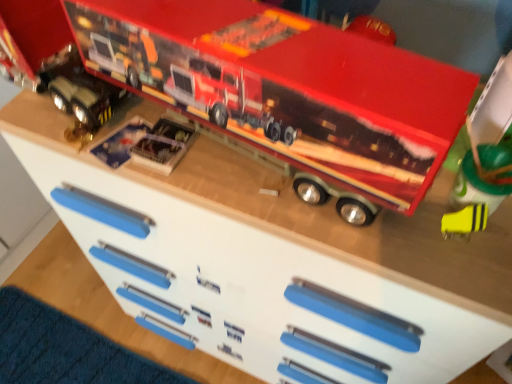
This screenshot has width=512, height=384. What do you see at coordinates (163, 145) in the screenshot?
I see `clear plastic toy at center, marked as the second toy in a left-to-right arrangement` at bounding box center [163, 145].

Describe the element at coordinates (287, 88) in the screenshot. I see `metallic red truck at upper center, placed as the 3th toy when sorted from left to right` at that location.

Identify the location of metallic silver toy truck at center, positioned as the fourth toy in right-to-left order. 121,142.

Describe the element at coordinates (464, 221) in the screenshot. Image resolution: width=512 pixels, height=384 pixels. I see `yellow matte eraser at lower right, which is the fourth toy from left to right` at that location.

Based on the photo, measure the distance between point (472, 229) and camera.

The depth of point (472, 229) is 20.71 inches.

Find the location of a particular element. clear plastic toy at center, which is counted as the third toy, starting from the right is located at coordinates (163, 145).

Would you say clear plastic toy at center, which is counted as the third toy, starting from the right, is to the left or to the right of yellow matte eraser at lower right, which is the fourth toy from left to right, in the picture?

clear plastic toy at center, which is counted as the third toy, starting from the right, is to the left of yellow matte eraser at lower right, which is the fourth toy from left to right.

Which point is more forward, (165,131) or (467,233)?

Point (467,233)

Is clear plastic toy at center, marked as the second toy in a left-to-right arrangement, not close to yellow matte eraser at lower right, placed as the first toy when sorted from right to left?

No.

Is clear plastic toy at center, which is counted as the third toy, starting from the right, oriented away from yellow matte eraser at lower right, which is the fourth toy from left to right?

No.

From the image's perspective, is clear plastic toy at center, which is counted as the third toy, starting from the right, below metallic red truck at upper center, placed as the 3th toy when sorted from left to right?

Yes, from the image's perspective, clear plastic toy at center, which is counted as the third toy, starting from the right, is beneath metallic red truck at upper center, placed as the 3th toy when sorted from left to right.

Is clear plastic toy at center, marked as the second toy in a left-to-right arrangement, with metallic red truck at upper center, placed as the 3th toy when sorted from left to right?

No, clear plastic toy at center, marked as the second toy in a left-to-right arrangement, is not with metallic red truck at upper center, placed as the 3th toy when sorted from left to right.

Is clear plastic toy at center, which is counted as the third toy, starting from the right, to the left or to the right of metallic red truck at upper center, placed as the 3th toy when sorted from left to right, in the image?

Clearly, clear plastic toy at center, which is counted as the third toy, starting from the right, is on the left of metallic red truck at upper center, placed as the 3th toy when sorted from left to right, in the image.

Is metallic red truck at upper center, placed as the 3th toy when sorted from left to right, at the back of clear plastic toy at center, which is counted as the third toy, starting from the right?

Yes, metallic red truck at upper center, placed as the 3th toy when sorted from left to right, is at the back of clear plastic toy at center, which is counted as the third toy, starting from the right.

From a real-world perspective, is yellow matte eraser at lower right, placed as the first toy when sorted from right to left, physically below metallic red truck at upper center, which ranks as the 2th toy in right-to-left order?

Yes.

Is yellow matte eraser at lower right, which is the fourth toy from left to right, facing towards metallic red truck at upper center, which ranks as the 2th toy in right-to-left order?

No, yellow matte eraser at lower right, which is the fourth toy from left to right, is not turned towards metallic red truck at upper center, which ranks as the 2th toy in right-to-left order.

Which object is further away from the camera, yellow matte eraser at lower right, placed as the first toy when sorted from right to left, or clear plastic toy at center, marked as the second toy in a left-to-right arrangement?

clear plastic toy at center, marked as the second toy in a left-to-right arrangement, is further from the camera.

From a real-world perspective, is yellow matte eraser at lower right, which is the fourth toy from left to right, beneath clear plastic toy at center, marked as the second toy in a left-to-right arrangement?

Incorrect, from a real-world perspective, yellow matte eraser at lower right, which is the fourth toy from left to right, is higher than clear plastic toy at center, marked as the second toy in a left-to-right arrangement.

How distant is yellow matte eraser at lower right, placed as the first toy when sorted from right to left, from clear plastic toy at center, marked as the second toy in a left-to-right arrangement?

yellow matte eraser at lower right, placed as the first toy when sorted from right to left, and clear plastic toy at center, marked as the second toy in a left-to-right arrangement, are 15.25 inches apart from each other.

Which object is positioned more to the right, yellow matte eraser at lower right, which is the fourth toy from left to right, or clear plastic toy at center, which is counted as the third toy, starting from the right?

Positioned to the right is yellow matte eraser at lower right, which is the fourth toy from left to right.

Does metallic red truck at upper center, which ranks as the 2th toy in right-to-left order, appear on the left side of metallic silver toy truck at center, arranged as the 1th toy when viewed from the left?

No, metallic red truck at upper center, which ranks as the 2th toy in right-to-left order, is not to the left of metallic silver toy truck at center, arranged as the 1th toy when viewed from the left.

How different are the orientations of metallic red truck at upper center, placed as the 3th toy when sorted from left to right, and metallic silver toy truck at center, arranged as the 1th toy when viewed from the left, in degrees?

The angle between the facing direction of metallic red truck at upper center, placed as the 3th toy when sorted from left to right, and the facing direction of metallic silver toy truck at center, arranged as the 1th toy when viewed from the left, is 5.5 degrees.

From a real-world perspective, which object rests below the other?

metallic silver toy truck at center, positioned as the fourth toy in right-to-left order.

Is metallic red truck at upper center, which ranks as the 2th toy in right-to-left order, aimed at metallic silver toy truck at center, positioned as the fourth toy in right-to-left order?

A: No, metallic red truck at upper center, which ranks as the 2th toy in right-to-left order, is not oriented towards metallic silver toy truck at center, positioned as the fourth toy in right-to-left order.

Does point (116, 155) come behind point (429, 137)?

Yes.

Could metallic red truck at upper center, placed as the 3th toy when sorted from left to right, be considered to be inside metallic silver toy truck at center, positioned as the fourth toy in right-to-left order?

No, metallic red truck at upper center, placed as the 3th toy when sorted from left to right, is not a part of metallic silver toy truck at center, positioned as the fourth toy in right-to-left order.

Which object is closer to the camera, metallic silver toy truck at center, arranged as the 1th toy when viewed from the left, or metallic red truck at upper center, which ranks as the 2th toy in right-to-left order?

Positioned in front is metallic red truck at upper center, which ranks as the 2th toy in right-to-left order.

From the image's perspective, which is below, metallic silver toy truck at center, positioned as the fourth toy in right-to-left order, or metallic red truck at upper center, placed as the 3th toy when sorted from left to right?

From the image's view, metallic silver toy truck at center, positioned as the fourth toy in right-to-left order, is below.

Which is correct: metallic red truck at upper center, which ranks as the 2th toy in right-to-left order, is inside yellow matte eraser at lower right, which is the fourth toy from left to right, or outside of it?

The correct answer is: outside.

Can you confirm if metallic red truck at upper center, which ranks as the 2th toy in right-to-left order, is shorter than yellow matte eraser at lower right, which is the fourth toy from left to right?

No.

Who is bigger, metallic red truck at upper center, which ranks as the 2th toy in right-to-left order, or yellow matte eraser at lower right, which is the fourth toy from left to right?

metallic red truck at upper center, which ranks as the 2th toy in right-to-left order, is bigger.

Considering the positions of objects metallic red truck at upper center, placed as the 3th toy when sorted from left to right, and yellow matte eraser at lower right, placed as the first toy when sorted from right to left, in the image provided, who is behind, metallic red truck at upper center, placed as the 3th toy when sorted from left to right, or yellow matte eraser at lower right, placed as the first toy when sorted from right to left,?

yellow matte eraser at lower right, placed as the first toy when sorted from right to left, is further from the camera.

Locate an element on the screen. The width and height of the screenshot is (512, 384). the 1st toy above the yellow matte eraser at lower right, placed as the first toy when sorted from right to left (from the image's perspective) is located at coordinates (163, 145).

From the image's perspective, count 2nd toys downward from the metallic red truck at upper center, which ranks as the 2th toy in right-to-left order, and point to it. Please provide its 2D coordinates.

[(163, 145)]

Based on their spatial positions, is metallic red truck at upper center, which ranks as the 2th toy in right-to-left order, or yellow matte eraser at lower right, placed as the first toy when sorted from right to left, further from metallic silver toy truck at center, arranged as the 1th toy when viewed from the left?

yellow matte eraser at lower right, placed as the first toy when sorted from right to left, lies further to metallic silver toy truck at center, arranged as the 1th toy when viewed from the left, than the other object.

Based on their spatial positions, is clear plastic toy at center, which is counted as the third toy, starting from the right, or metallic silver toy truck at center, positioned as the fourth toy in right-to-left order, further from metallic red truck at upper center, placed as the 3th toy when sorted from left to right?

metallic silver toy truck at center, positioned as the fourth toy in right-to-left order, is further to metallic red truck at upper center, placed as the 3th toy when sorted from left to right.

Estimate the real-world distances between objects in this image. Which object is closer to clear plastic toy at center, which is counted as the third toy, starting from the right, metallic silver toy truck at center, arranged as the 1th toy when viewed from the left, or yellow matte eraser at lower right, placed as the first toy when sorted from right to left?

Based on the image, metallic silver toy truck at center, arranged as the 1th toy when viewed from the left, appears to be nearer to clear plastic toy at center, which is counted as the third toy, starting from the right.

Which object lies further to the anchor point metallic red truck at upper center, which ranks as the 2th toy in right-to-left order, yellow matte eraser at lower right, placed as the first toy when sorted from right to left, or clear plastic toy at center, which is counted as the third toy, starting from the right?

yellow matte eraser at lower right, placed as the first toy when sorted from right to left, is positioned further to the anchor metallic red truck at upper center, which ranks as the 2th toy in right-to-left order.

Based on their spatial positions, is metallic red truck at upper center, placed as the 3th toy when sorted from left to right, or yellow matte eraser at lower right, which is the fourth toy from left to right, further from clear plastic toy at center, which is counted as the third toy, starting from the right?

yellow matte eraser at lower right, which is the fourth toy from left to right, is positioned further to the anchor clear plastic toy at center, which is counted as the third toy, starting from the right.

From the image, which object appears to be nearer to yellow matte eraser at lower right, placed as the first toy when sorted from right to left, metallic red truck at upper center, which ranks as the 2th toy in right-to-left order, or clear plastic toy at center, marked as the second toy in a left-to-right arrangement?

metallic red truck at upper center, which ranks as the 2th toy in right-to-left order.

Estimate the real-world distances between objects in this image. Which object is closer to metallic red truck at upper center, placed as the 3th toy when sorted from left to right, metallic silver toy truck at center, positioned as the fourth toy in right-to-left order, or yellow matte eraser at lower right, which is the fourth toy from left to right?

metallic silver toy truck at center, positioned as the fourth toy in right-to-left order, is positioned closer to the anchor metallic red truck at upper center, placed as the 3th toy when sorted from left to right.

Considering their positions, is clear plastic toy at center, marked as the second toy in a left-to-right arrangement, positioned further to metallic red truck at upper center, placed as the 3th toy when sorted from left to right, than yellow matte eraser at lower right, placed as the first toy when sorted from right to left?

yellow matte eraser at lower right, placed as the first toy when sorted from right to left, is positioned further to the anchor metallic red truck at upper center, placed as the 3th toy when sorted from left to right.

Locate an element on the screen. Image resolution: width=512 pixels, height=384 pixels. toy between clear plastic toy at center, which is counted as the third toy, starting from the right, and yellow matte eraser at lower right, placed as the first toy when sorted from right to left is located at coordinates (287, 88).